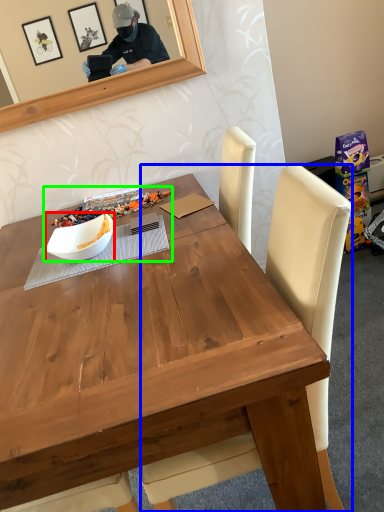
Question: Considering the real-world distances, which object is farthest from bowl (highlighted by a red box)? chair (highlighted by a blue box) or fruit dish (highlighted by a green box)?

Choices:
 (A) chair
 (B) fruit dish

Answer: (A)